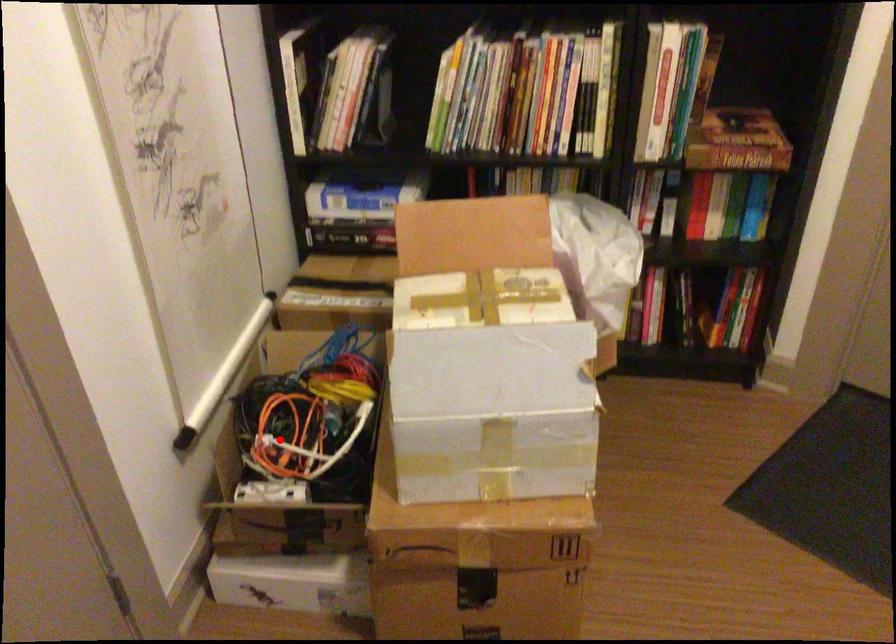
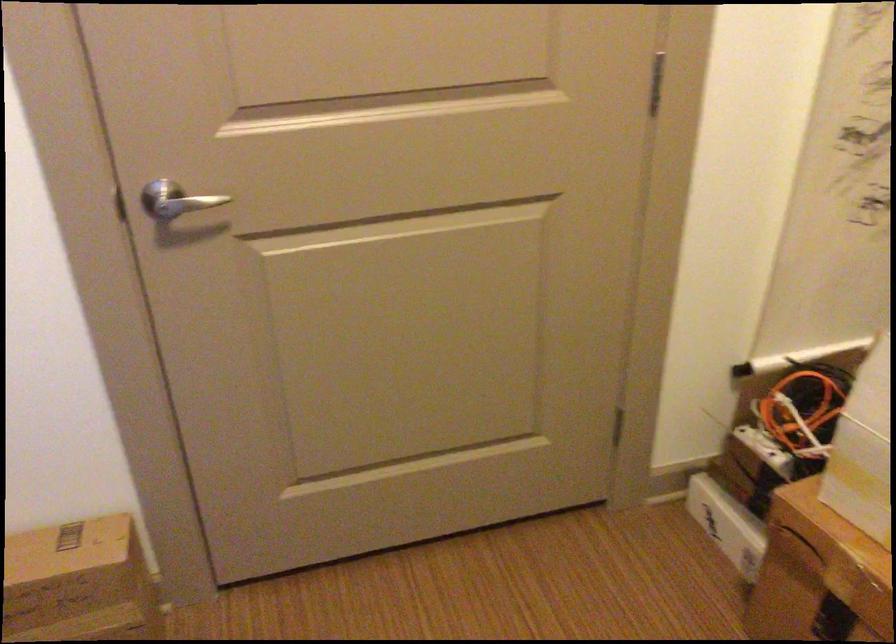
In the second image, find the point that corresponds to the highlighted location in the first image.

(803, 408)